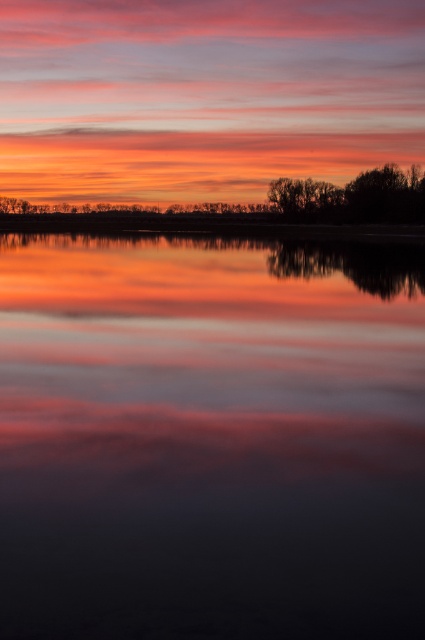
Question: Does smooth water at center have a smaller size compared to silhouette tree at center?

Choices:
 (A) no
 (B) yes

Answer: (A)

Question: Which of the following is the closest to the observer?

Choices:
 (A) silhouette tree at center
 (B) silhouette tree at right

Answer: (B)

Question: Which object is the closest to the silhouette tree at right?

Choices:
 (A) silhouette tree at center
 (B) smooth water at center

Answer: (A)

Question: Observing the image, what is the correct spatial positioning of smooth water at center in reference to silhouette tree at center?

Choices:
 (A) left
 (B) right

Answer: (A)

Question: Which point appears farthest from the camera in this image?

Choices:
 (A) (300, 385)
 (B) (329, 195)

Answer: (B)

Question: Is silhouette tree at right wider than silhouette tree at center?

Choices:
 (A) no
 (B) yes

Answer: (B)